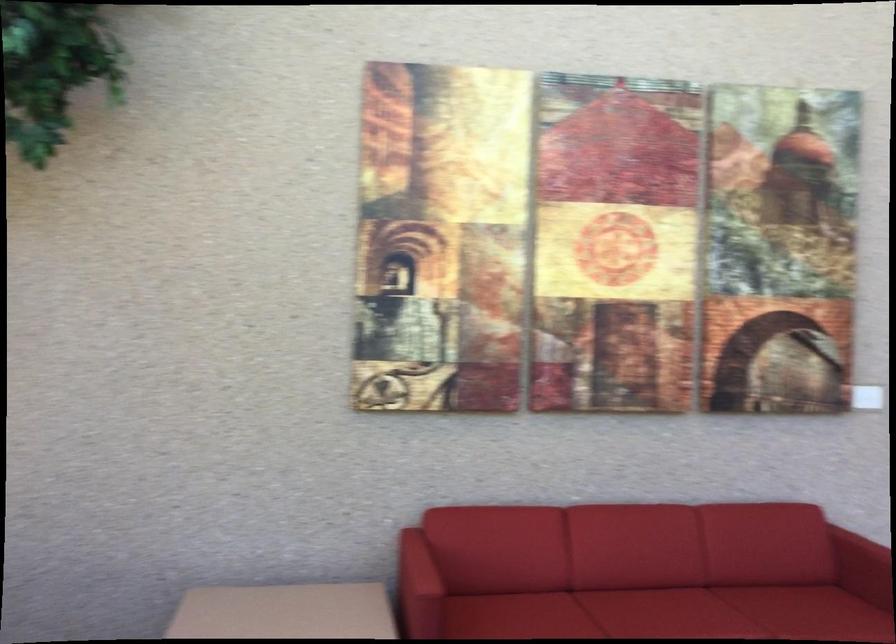
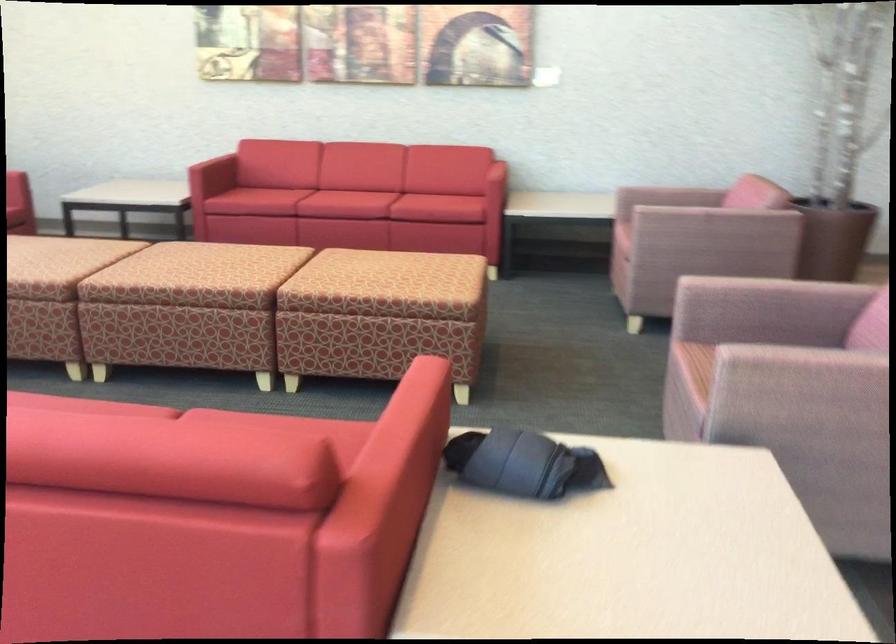
In a continuous first-person perspective shot, in which direction is the camera moving?

The movement direction of the cameraman is right, backward.